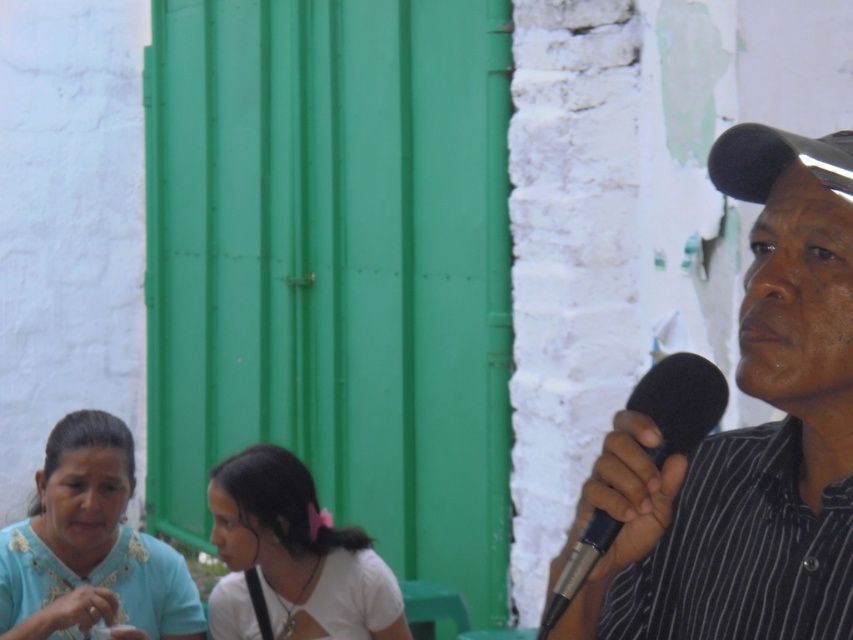
Question: Is black striped shirt at right above teal fabric shirt at lower left?

Choices:
 (A) yes
 (B) no

Answer: (A)

Question: Can you confirm if white matte shirt at center is bigger than black foam microphone at right?

Choices:
 (A) no
 (B) yes

Answer: (B)

Question: Which object is closer to the camera taking this photo?

Choices:
 (A) teal fabric shirt at lower left
 (B) black foam microphone at right
 (C) black striped shirt at right

Answer: (B)

Question: Can you confirm if black striped shirt at right is positioned below white matte shirt at center?

Choices:
 (A) no
 (B) yes

Answer: (A)

Question: Which object is positioned closest to the white matte shirt at center?

Choices:
 (A) black foam microphone at right
 (B) black striped shirt at right

Answer: (B)

Question: Which object appears closest to the camera in this image?

Choices:
 (A) teal fabric shirt at lower left
 (B) black foam microphone at right
 (C) black striped shirt at right
 (D) white matte shirt at center

Answer: (B)